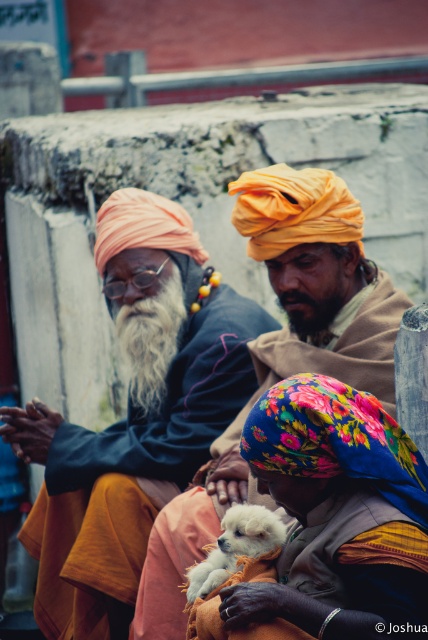
Question: Estimate the real-world distances between objects in this image. Which object is closer to the whitefluffybeard at center?

Choices:
 (A) white fluffy dog at center
 (B) matte orange turban at left
 (C) gray matte beard at center

Answer: (B)

Question: Does white fluffy dog at center appear over gray matte beard at center?

Choices:
 (A) yes
 (B) no

Answer: (B)

Question: Which point is closer to the camera?

Choices:
 (A) (157, 358)
 (B) (276, 333)

Answer: (B)

Question: Which object is closer to the camera taking this photo?

Choices:
 (A) gray matte beard at center
 (B) matte orange turban at left

Answer: (A)

Question: From the image, what is the correct spatial relationship of matte orange turban at left in relation to orange turbaned man at center?

Choices:
 (A) right
 (B) left

Answer: (B)

Question: Can you confirm if orange turbaned man at center is wider than white fluffy dog at center?

Choices:
 (A) no
 (B) yes

Answer: (B)